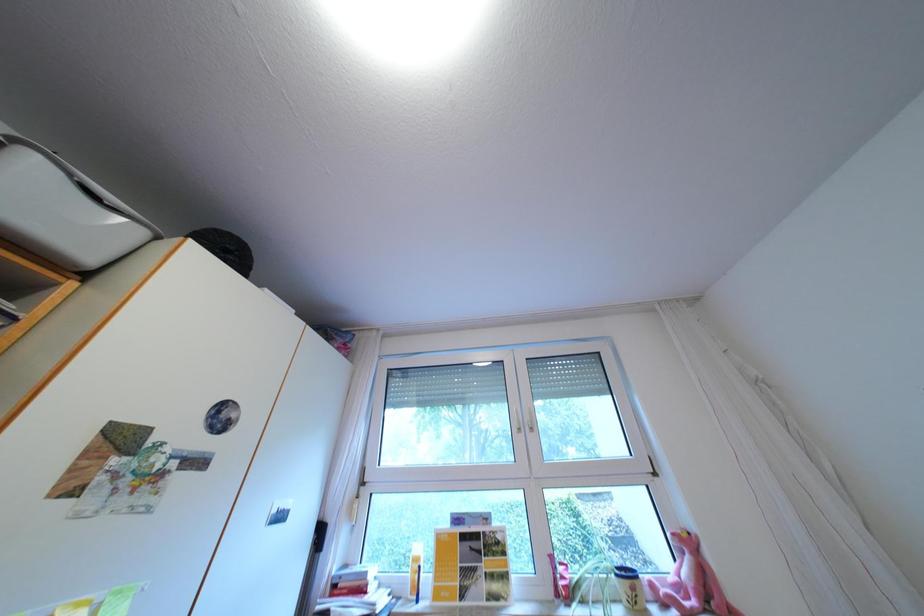
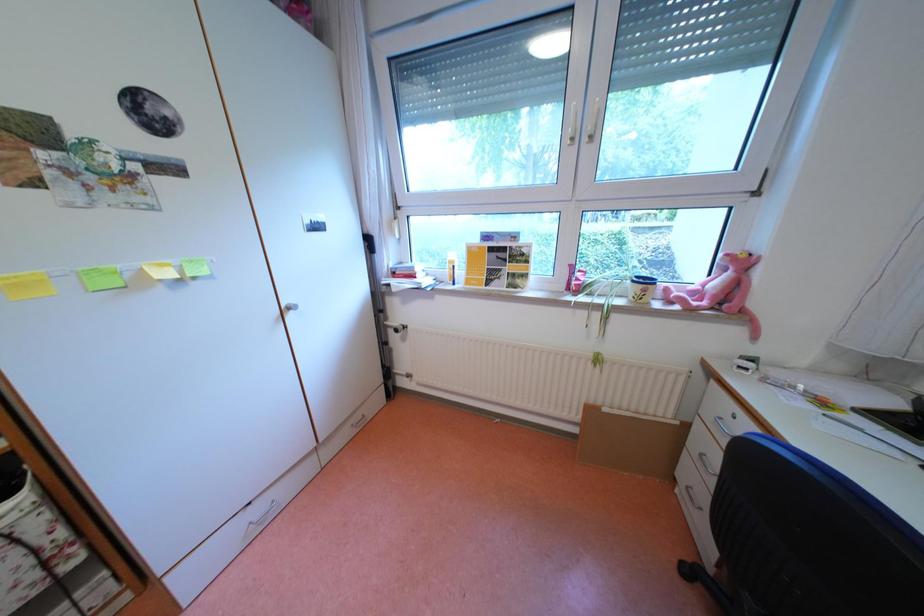
In the scene shown: Based on the continuous images, in which direction is the camera rotating?

The camera's rotation is toward left-down.